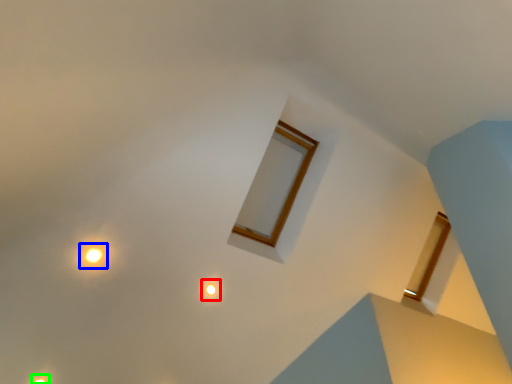
Question: Estimate the real-world distances between objects in this image. Which object is farther from light (highlighted by a red box), light (highlighted by a blue box) or light (highlighted by a green box)?

Choices:
 (A) light
 (B) light

Answer: (B)